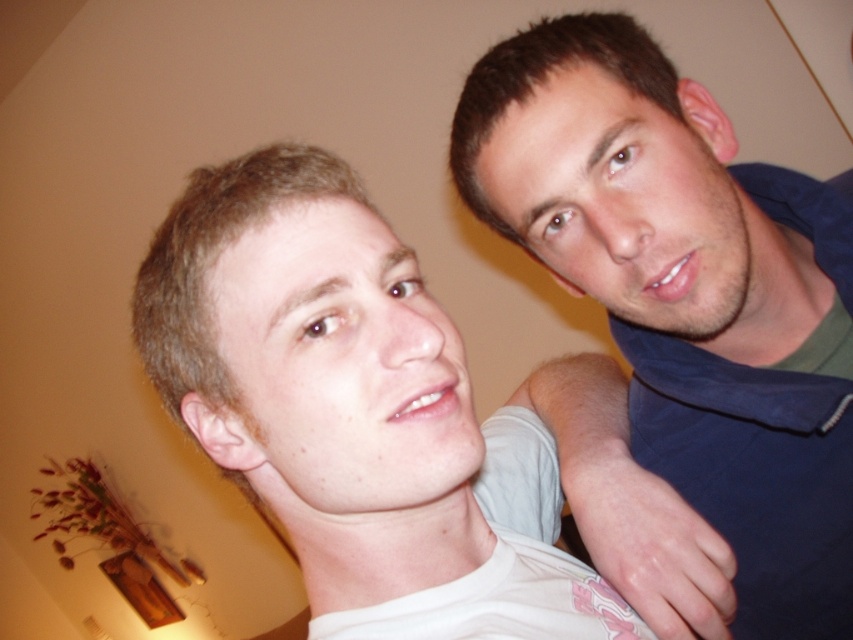
Between point (703, 304) and point (456, 369), which one is positioned in front?

Point (456, 369) is more forward.

Does blue cotton shirt at upper right have a larger size compared to white matte shirt at center?

No, blue cotton shirt at upper right is not bigger than white matte shirt at center.

Find the location of `blue cotton shirt at upper right`. blue cotton shirt at upper right is located at coordinates (688, 291).